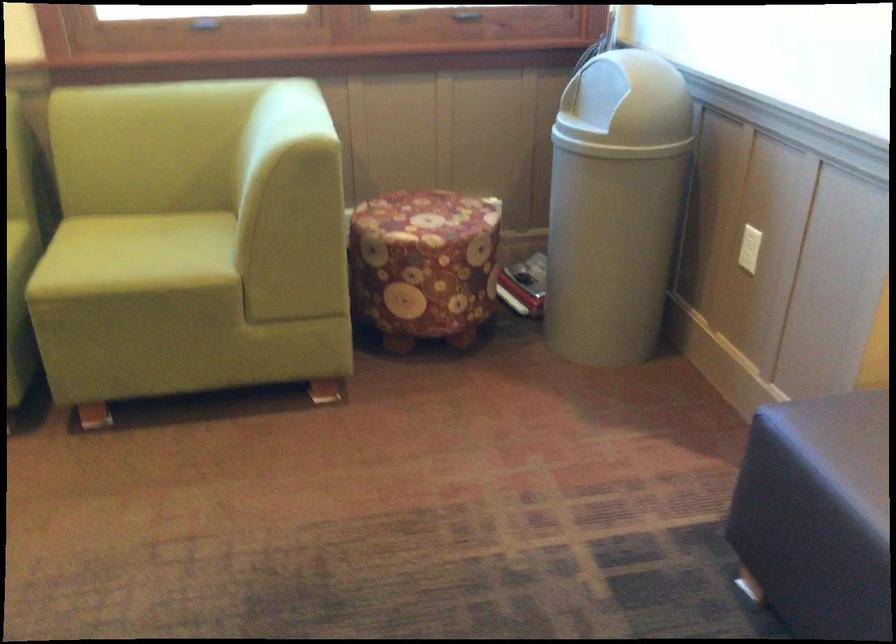
What are the coordinates of `patterned round ottoman` in the screenshot? It's located at (414, 207).